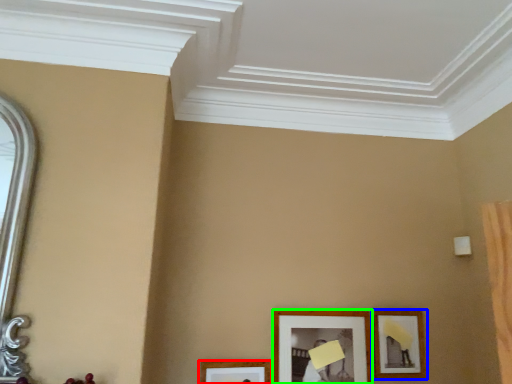
Question: Which object is positioned closest to picture frame (highlighted by a red box)? Select from picture frame (highlighted by a blue box) and picture frame (highlighted by a green box).

Choices:
 (A) picture frame
 (B) picture frame

Answer: (B)